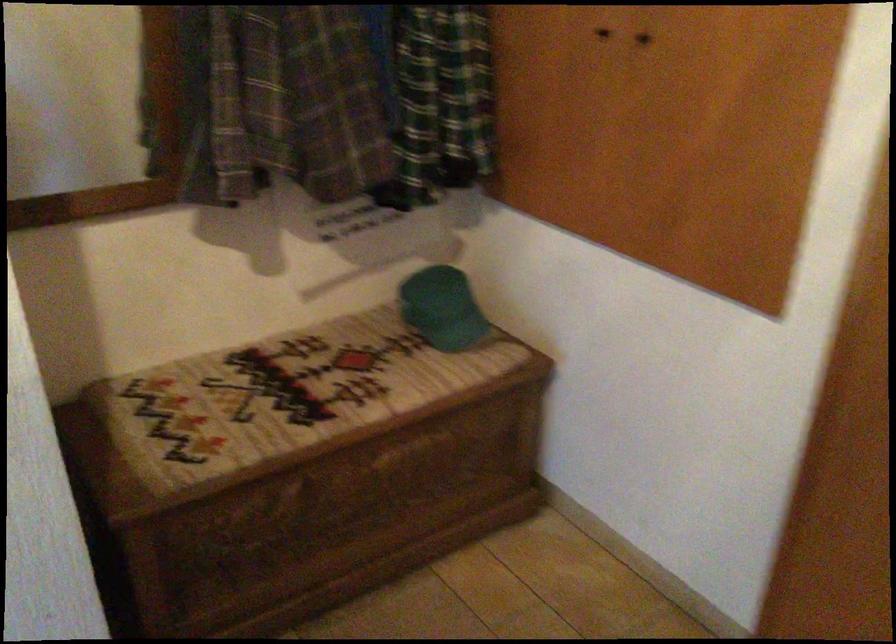
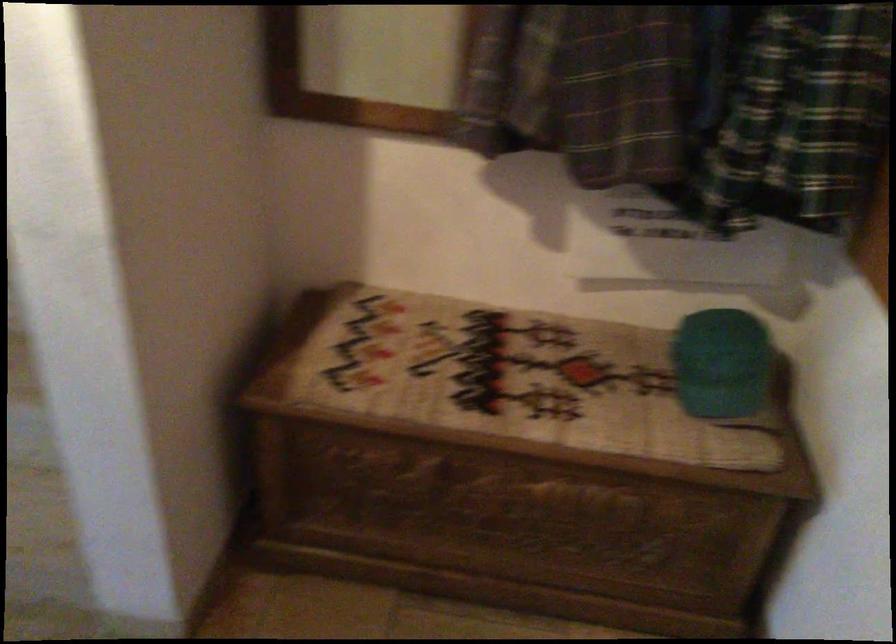
Question: The camera is either moving clockwise (left) or counter-clockwise (right) around the object. The first image is from the beginning of the video and the second image is from the end. Is the camera moving left or right when shooting the video?

Choices:
 (A) Left
 (B) Right

Answer: (B)